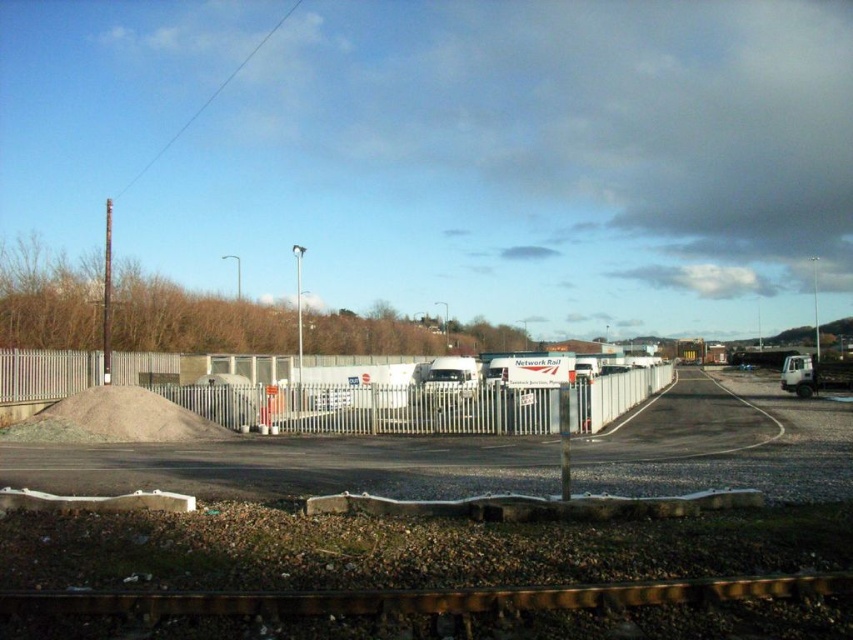
You are a construction worker who needs to move a heavy equipment from the gray gravel pile at lower left to the white matte trailer truck at center. Can you directly drive the equipment through the gravel pile to reach the truck?

The gray gravel pile at lower left is in front of the white matte trailer truck at center, so the equipment can drive through the gravel pile to reach the truck since it is directly in front.